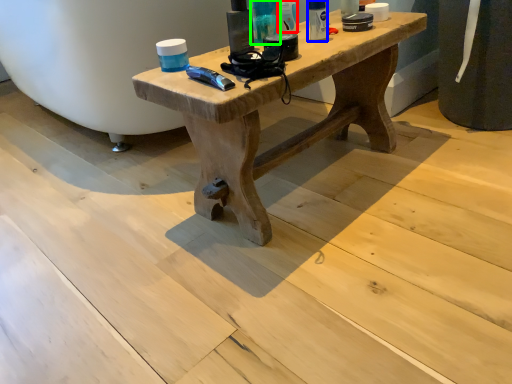
Question: Which object is positioned farthest from toiletry (highlighted by a red box)? Select from toiletry (highlighted by a blue box) and toiletry (highlighted by a green box).

Choices:
 (A) toiletry
 (B) toiletry

Answer: (A)